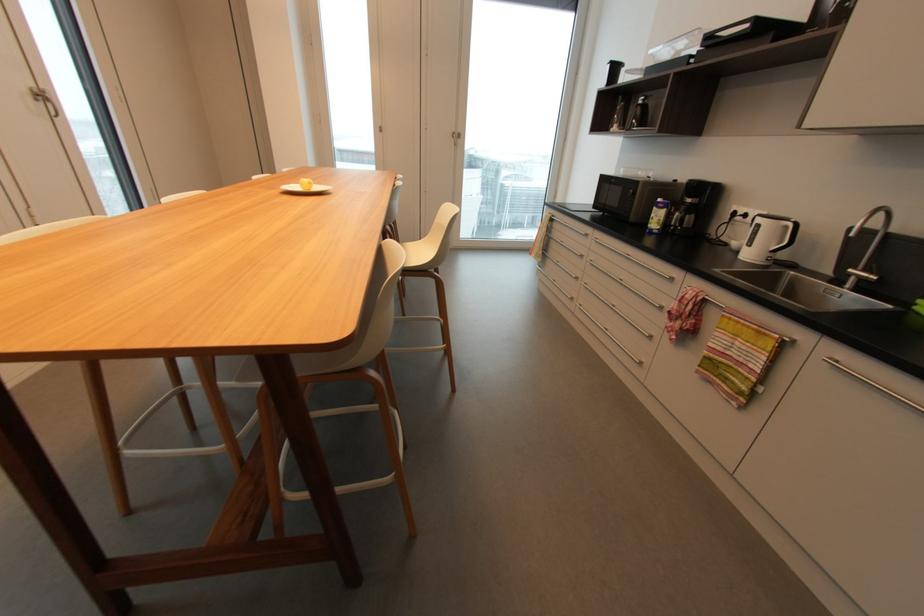
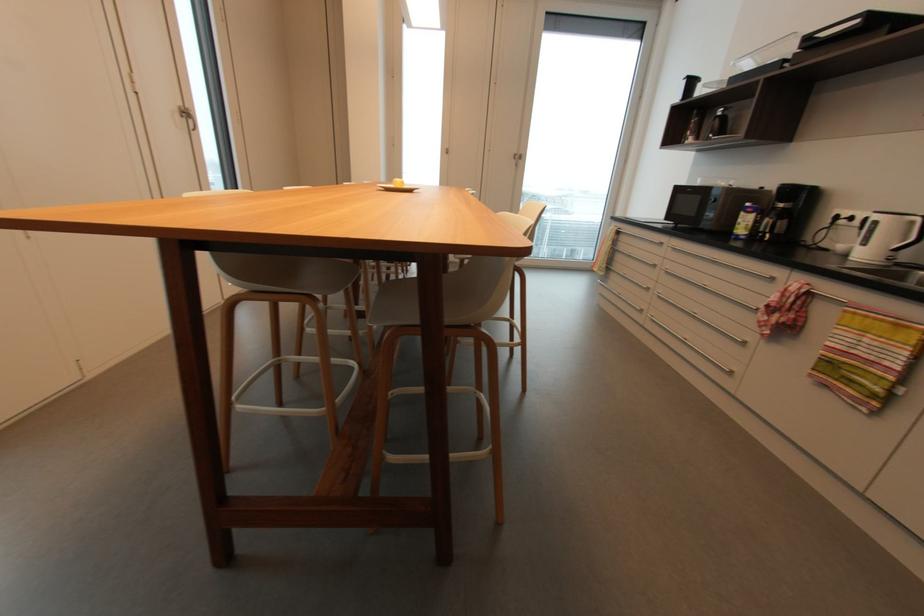
Find the pixel in the second image that matches pixel 35 91 in the first image.

(183, 108)